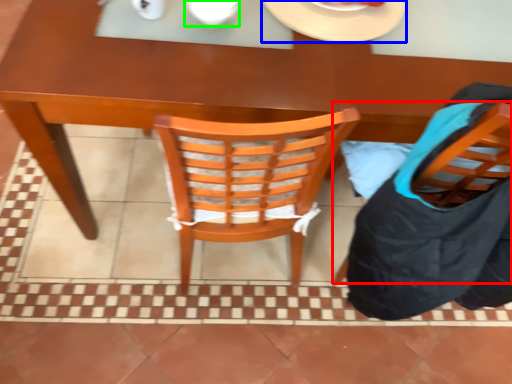
Question: Estimate the real-world distances between objects in this image. Which object is farther from chair (highlighted by a red box), plate (highlighted by a blue box) or tableware (highlighted by a green box)?

Choices:
 (A) plate
 (B) tableware

Answer: (B)